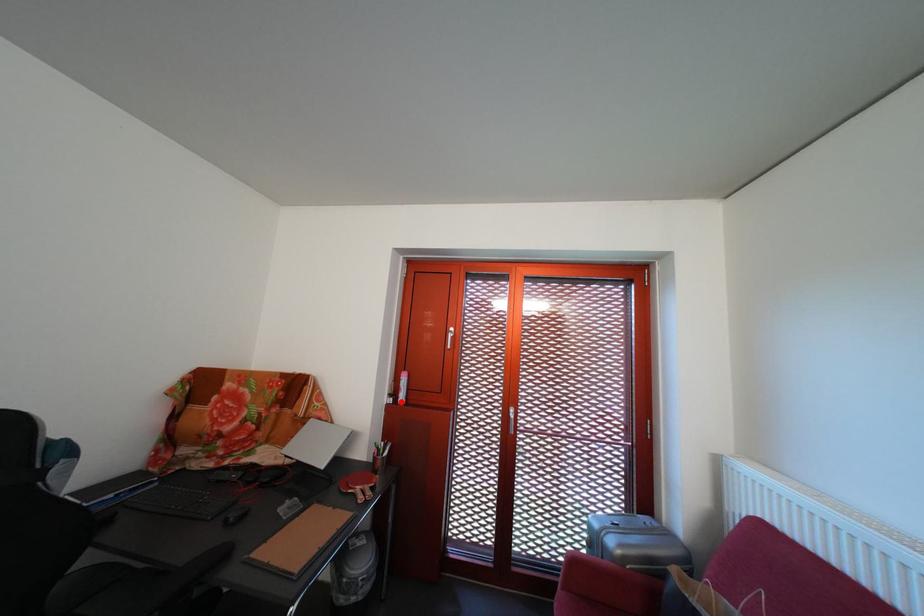
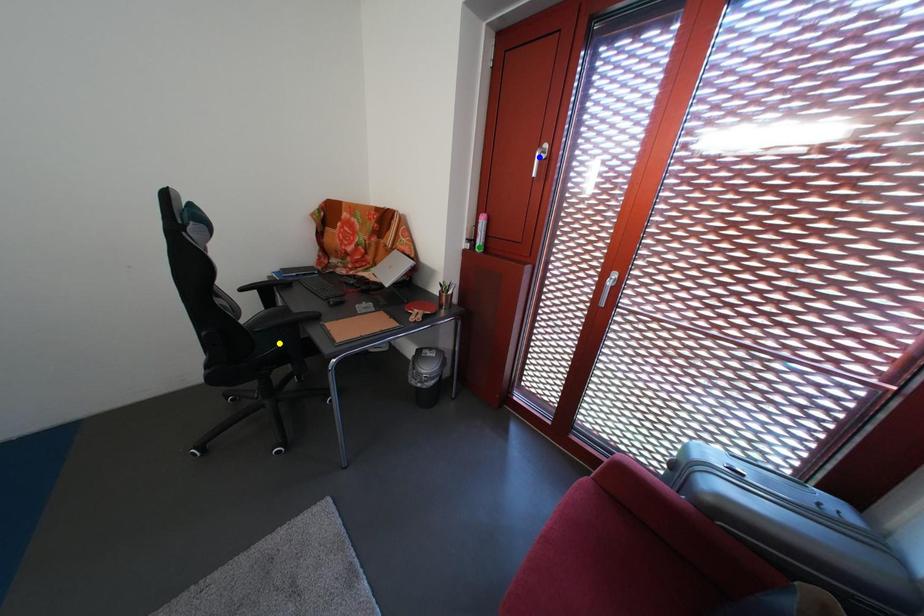
Question: I am providing you with two images of the same scene from different viewpoints. A red point is marked on the first image. You are given multiple points on the second image. Can you choose the point in image 2 that corresponds to the point in image 1?

Choices:
 (A) blue point
 (B) green point
 (C) yellow point

Answer: (B)